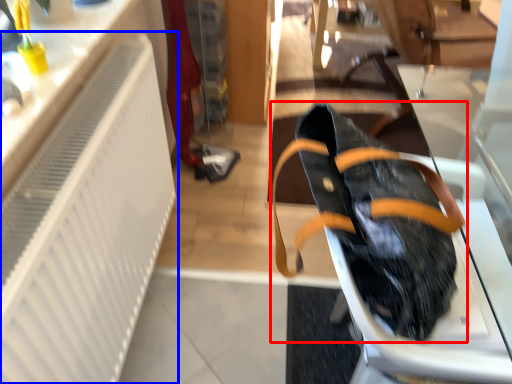
Question: Which of the following is the closest to the observer, footwear (highlighted by a red box) or radiator (highlighted by a blue box)?

Choices:
 (A) footwear
 (B) radiator

Answer: (B)